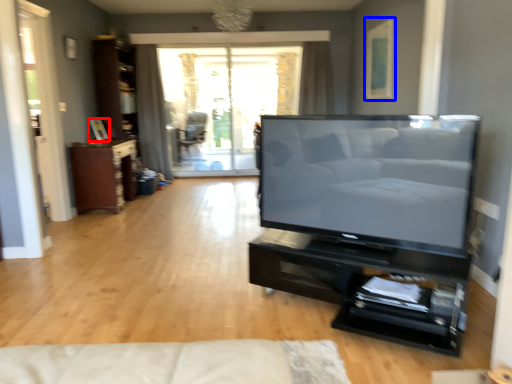
Question: Among these objects, which one is farthest to the camera, picture frame (highlighted by a red box) or picture frame (highlighted by a blue box)?

Choices:
 (A) picture frame
 (B) picture frame

Answer: (A)